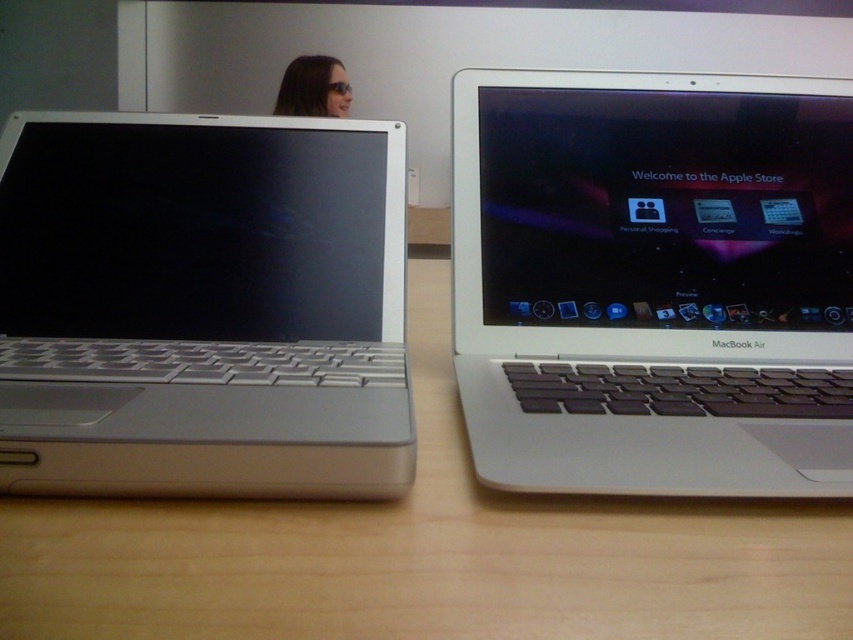
You are taking a photo of the two laptops on the desk. You want to focus on the point that is closer to you. Which point should you choose between point (126, 122) and point (508, 499)?

Point (508, 499) is closer to you than point (126, 122), so you should choose point (508, 499) to focus on.

You are a technician trying to identify which laptop has the point at coordinate (202, 307). Based on the scene, which laptop is the point on?

The point is on the silver metallic laptop at left.

You are a delivery robot navigating a desk with two laptops. You need to place a package between the two points marked as point [598,326] and point [294,102]. Which point should you move towards first to ensure the package is placed correctly?

Point [598,326] is in front of point [294,102], so you should move towards point [294,102] first to place the package between them.